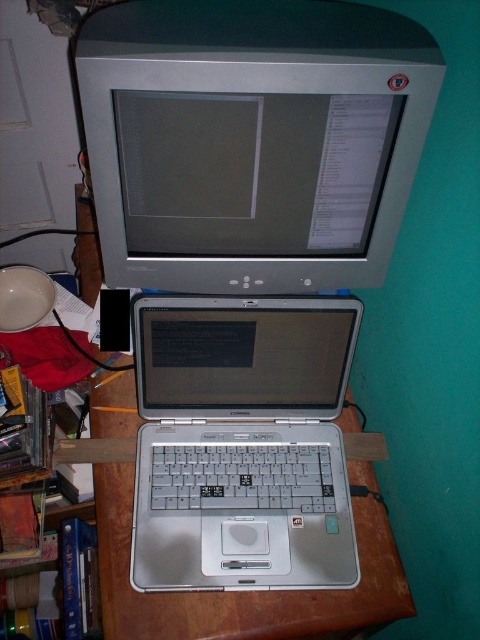
Does satin silver monitor at upper center lie in front of silver metallic laptop at center?

Yes, satin silver monitor at upper center is in front of silver metallic laptop at center.

This screenshot has height=640, width=480. Describe the element at coordinates (252, 140) in the screenshot. I see `satin silver monitor at upper center` at that location.

This screenshot has width=480, height=640. Find the location of `satin silver monitor at upper center`. satin silver monitor at upper center is located at coordinates (252, 140).